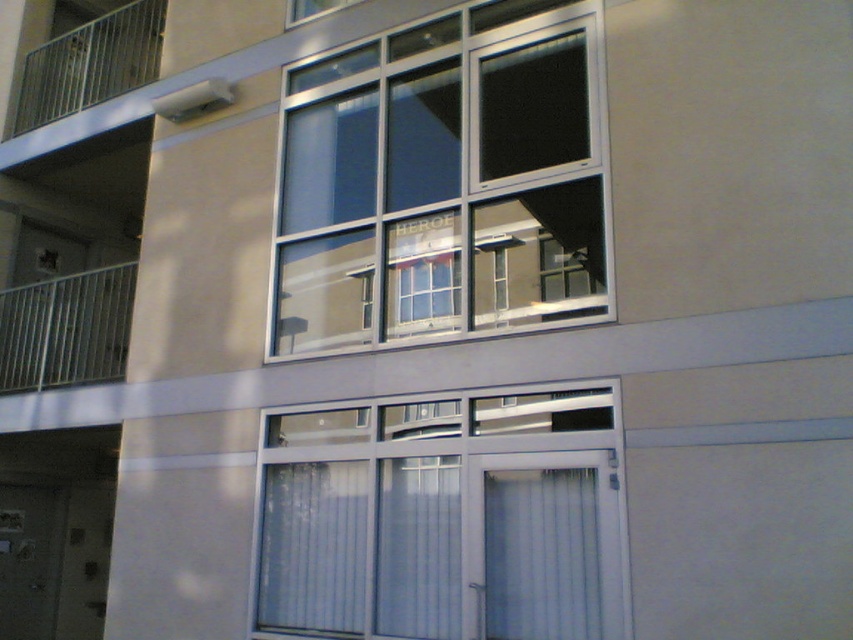
Who is more forward, (422, 312) or (410, 529)?

Point (410, 529) is more forward.

Who is higher up, clear glass window at center or white plastic window at center?

clear glass window at center is higher up.

Locate an element on the screen. clear glass window at center is located at coordinates (440, 182).

Which of these two, transparent glass door at lower left or transparent glass window at upper center, stands taller?

transparent glass door at lower left is taller.

Between transparent glass door at lower left and transparent glass window at upper center, which one appears on the right side from the viewer's perspective?

transparent glass window at upper center

Image resolution: width=853 pixels, height=640 pixels. I want to click on transparent glass door at lower left, so coord(28,560).

Does metallic silver balcony at left appear over metallic railing at upper left?

No, metallic silver balcony at left is not above metallic railing at upper left.

Can you confirm if metallic silver balcony at left is positioned to the right of metallic railing at upper left?

Correct, you'll find metallic silver balcony at left to the right of metallic railing at upper left.

Is point (117, 336) closer to camera compared to point (65, 54)?

That is True.

Identify the location of metallic silver balcony at left. (67, 330).